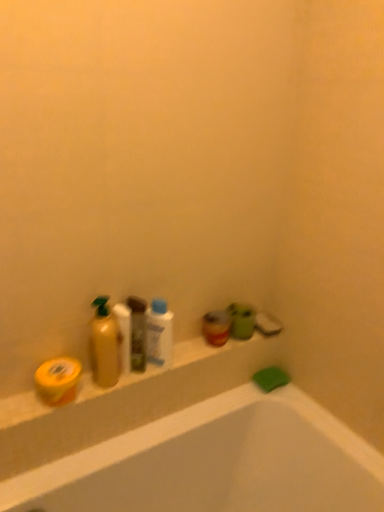
Question: Considering the relative sizes of white glossy mouthwash at center, positioned as the 1th mouthwash in front-to-back order, and yellow matte container at lower left in the image provided, is white glossy mouthwash at center, positioned as the 1th mouthwash in front-to-back order, wider than yellow matte container at lower left?

Choices:
 (A) yes
 (B) no

Answer: (B)

Question: Can you confirm if white glossy mouthwash at center, which is the 2th mouthwash from back to front, is smaller than yellow matte container at lower left?

Choices:
 (A) no
 (B) yes

Answer: (B)

Question: Considering the relative sizes of white glossy mouthwash at center, positioned as the 1th mouthwash in front-to-back order, and yellow matte container at lower left in the image provided, is white glossy mouthwash at center, positioned as the 1th mouthwash in front-to-back order, shorter than yellow matte container at lower left?

Choices:
 (A) yes
 (B) no

Answer: (B)

Question: Is white glossy mouthwash at center, arranged as the 2th mouthwash when viewed from the right, not within yellow matte container at lower left?

Choices:
 (A) no
 (B) yes

Answer: (B)

Question: Is white glossy mouthwash at center, the 1th mouthwash viewed from the left, taller than yellow matte container at lower left?

Choices:
 (A) yes
 (B) no

Answer: (A)

Question: From a real-world perspective, is white glossy mouthwash at center, arranged as the 2th mouthwash when viewed from the right, under yellow matte container at lower left?

Choices:
 (A) no
 (B) yes

Answer: (A)

Question: Is translucent plastic mouthwash at center, placed as the 1th mouthwash when sorted from back to front, at the left side of yellow matte bar of soap at left, positioned as the first soap in top-to-bottom order?

Choices:
 (A) no
 (B) yes

Answer: (A)

Question: Does translucent plastic mouthwash at center, which is the 2th mouthwash in left-to-right order, have a larger size compared to yellow matte bar of soap at left, positioned as the first soap in top-to-bottom order?

Choices:
 (A) no
 (B) yes

Answer: (A)

Question: Is the surface of translucent plastic mouthwash at center, placed as the second mouthwash when sorted from front to back, in direct contact with yellow matte bar of soap at left, which ranks as the second soap in bottom-to-top order?

Choices:
 (A) yes
 (B) no

Answer: (B)

Question: Is translucent plastic mouthwash at center, marked as the first mouthwash in a right-to-left arrangement, in front of yellow matte bar of soap at left, arranged as the first soap when viewed from the left?

Choices:
 (A) no
 (B) yes

Answer: (A)

Question: Can you confirm if translucent plastic mouthwash at center, placed as the 1th mouthwash when sorted from back to front, is smaller than yellow matte bar of soap at left, positioned as the first soap in top-to-bottom order?

Choices:
 (A) yes
 (B) no

Answer: (A)

Question: Is translucent plastic mouthwash at center, placed as the 1th mouthwash when sorted from back to front, shorter than yellow matte bar of soap at left, which ranks as the second soap in bottom-to-top order?

Choices:
 (A) no
 (B) yes

Answer: (A)

Question: Is yellow matte container at lower left in contact with white glossy mouthwash at center, arranged as the 2th mouthwash when viewed from the right?

Choices:
 (A) yes
 (B) no

Answer: (B)